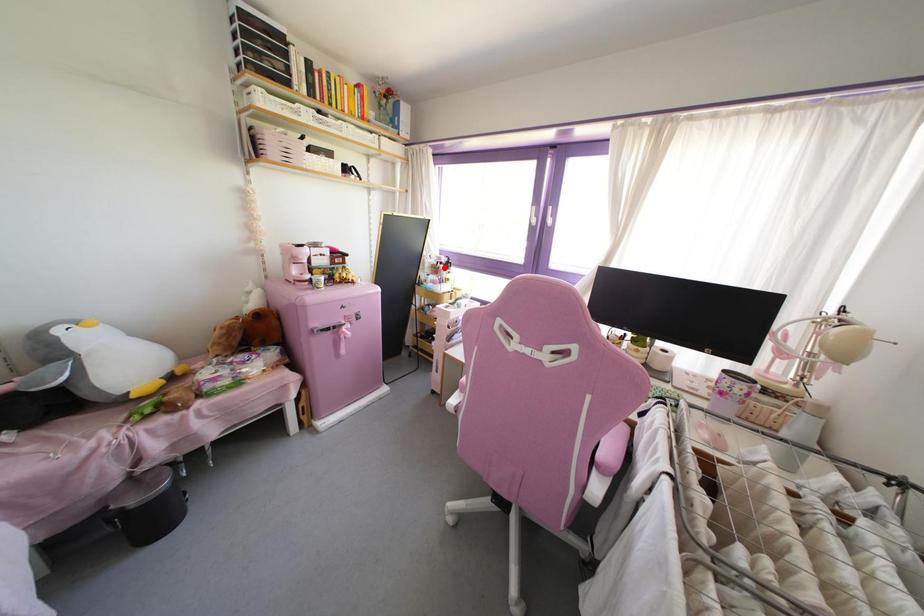
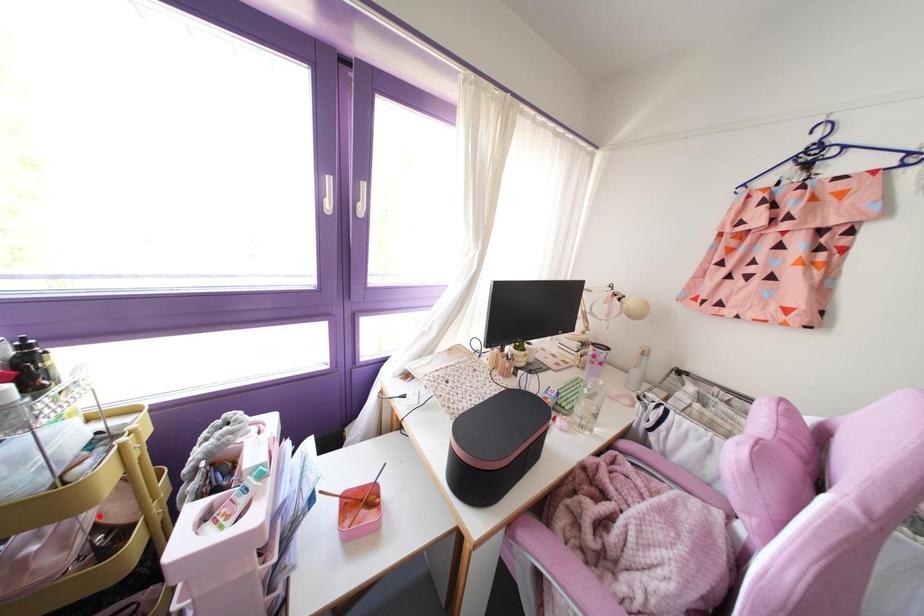
I am providing you with two images of the same scene from different viewpoints. A red point is marked on the first image and another point is marked on the second image. Are the points marked in image1 and image2 representing the same 3D position?

Answer: No